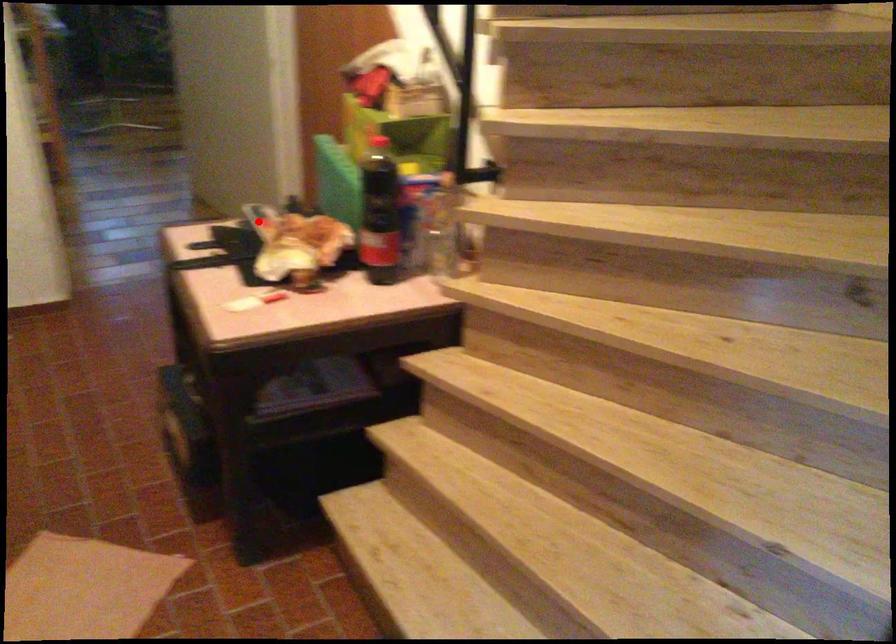
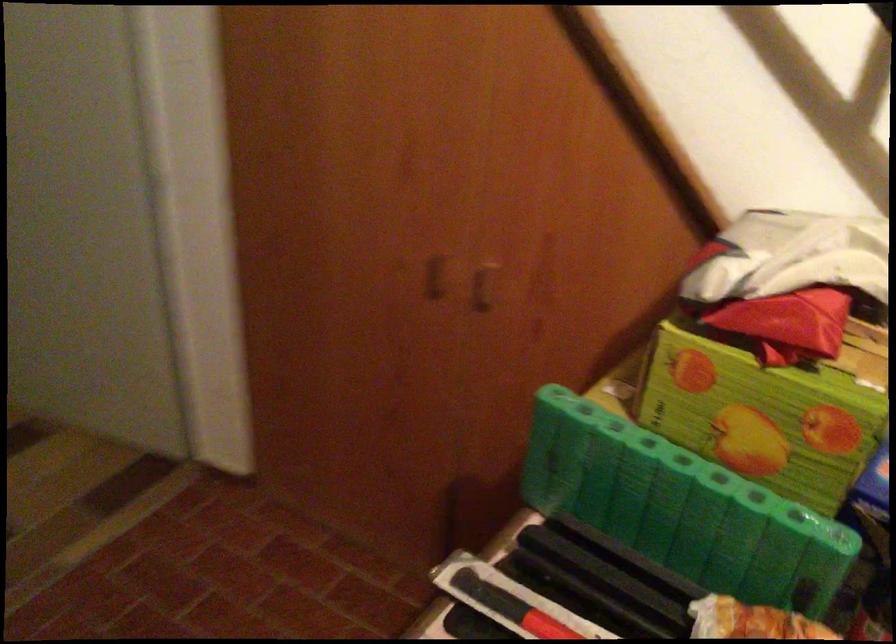
Find the pixel in the second image that matches the highlighted location in the first image.

(510, 605)